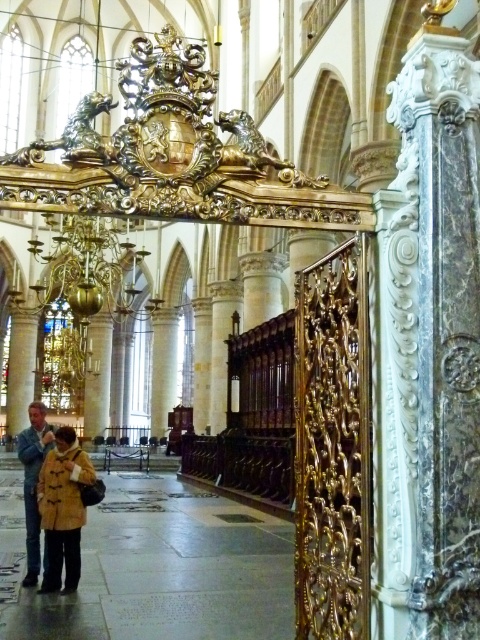
Is brown fuzzy coat at lower left above brown leather jacket at lower left?

Yes, brown fuzzy coat at lower left is above brown leather jacket at lower left.

Who is positioned more to the right, brown fuzzy coat at lower left or brown leather jacket at lower left?

Positioned to the right is brown fuzzy coat at lower left.

Is point (58, 481) farther from viewer compared to point (29, 512)?

No.

Where is `brown fuzzy coat at lower left`? Image resolution: width=480 pixels, height=640 pixels. brown fuzzy coat at lower left is located at coordinates (62, 508).